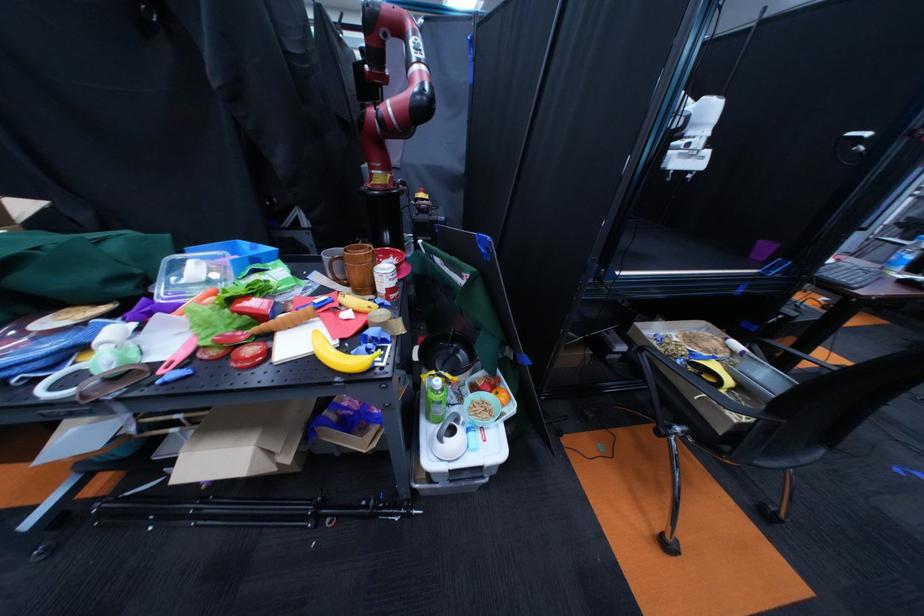
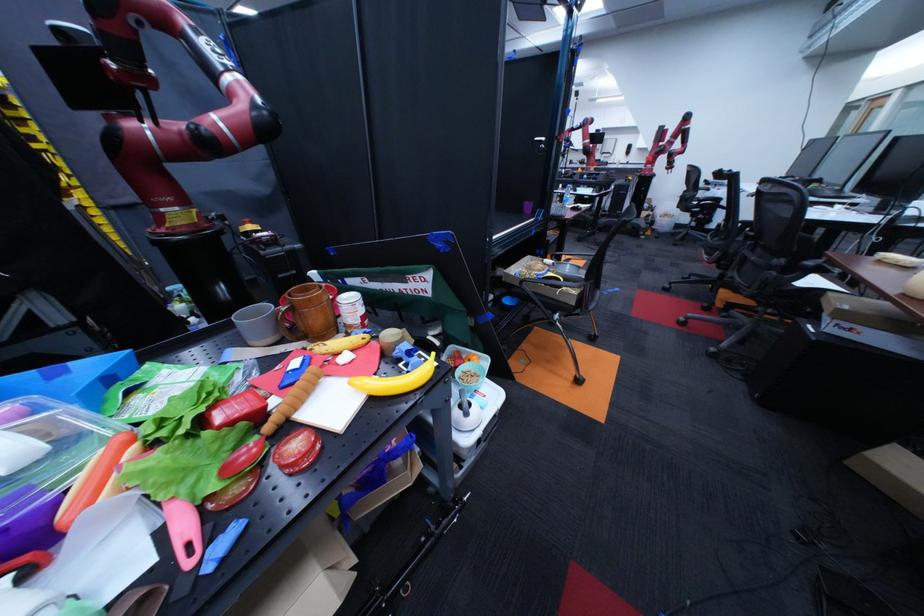
Question: Based on the continuous images, in which direction is the camera rotating? Reply with the corresponding letter.

Choices:
 (A) Left
 (B) Right
 (C) Up
 (D) Down

Answer: (B)